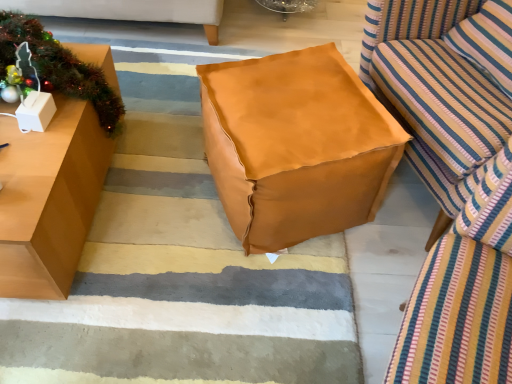
What do you see at coordinates (453, 178) in the screenshot? I see `striped fabric studio couch at right` at bounding box center [453, 178].

At what (x,y) coordinates should I click in order to perform the action: click on brown leather ottoman at center. Please return your answer as a coordinate pair (x, y). Looking at the image, I should click on (182, 274).

Locate an element on the screen. This screenshot has width=512, height=384. metallic green garland at left is located at coordinates coord(60,67).

Image resolution: width=512 pixels, height=384 pixels. In order to click on white cardboard box at left in this screenshot , I will do `click(36, 111)`.

Image resolution: width=512 pixels, height=384 pixels. Find the location of `matte brown table at left`. matte brown table at left is located at coordinates (49, 198).

Where is `striped fabric studio couch at right`? striped fabric studio couch at right is located at coordinates (453, 178).

Is white cardboard box at left not near leather-like tan bean bag at center?

That's not correct — white cardboard box at left is a little close to leather-like tan bean bag at center.

Do you think white cardboard box at left is within leather-like tan bean bag at center, or outside of it?

white cardboard box at left is located beyond the bounds of leather-like tan bean bag at center.

At what (x,y) coordinates should I click in order to perform the action: click on cardboard box above the leather-like tan bean bag at center (from the image's perspective). Please return your answer as a coordinate pair (x, y). Image resolution: width=512 pixels, height=384 pixels. Looking at the image, I should click on click(x=36, y=111).

From the image's perspective, is white cardboard box at left under leather-like tan bean bag at center?

Actually, white cardboard box at left appears above leather-like tan bean bag at center in the image.

Which of these two, striped fabric pillow at right or white cardboard box at left, is thinner?

Thinner between the two is white cardboard box at left.

The height and width of the screenshot is (384, 512). In order to click on pillow above the white cardboard box at left (from the image's perspective) in this screenshot , I will do `click(487, 42)`.

Is there a large distance between striped fabric pillow at right and white cardboard box at left?

That's right, there is a large distance between striped fabric pillow at right and white cardboard box at left.

Is striped fabric pillow at right outside of white cardboard box at left?

That's correct, striped fabric pillow at right is outside of white cardboard box at left.

Would you say leather-like tan bean bag at center is outside striped fabric pillow at right?

Yes, leather-like tan bean bag at center is located beyond the bounds of striped fabric pillow at right.

Is point (282, 117) closer to viewer compared to point (467, 21)?

Yes.

How far apart are leather-like tan bean bag at center and striped fabric pillow at right?

leather-like tan bean bag at center is 59.32 centimeters away from striped fabric pillow at right.

Does leather-like tan bean bag at center have a larger size compared to striped fabric pillow at right?

Yes.

From a real-world perspective, is white cardboard box at left positioned above or below metallic green garland at left?

white cardboard box at left is above metallic green garland at left.

Can metallic green garland at left be found inside white cardboard box at left?

No, metallic green garland at left is not surrounded by white cardboard box at left.

Is the surface of white cardboard box at left in direct contact with metallic green garland at left?

No, white cardboard box at left is not beside metallic green garland at left.

Can you confirm if white cardboard box at left is smaller than metallic green garland at left?

Indeed, white cardboard box at left has a smaller size compared to metallic green garland at left.

Is matte brown table at left wider than brown leather ottoman at center?

In fact, matte brown table at left might be narrower than brown leather ottoman at center.

Is matte brown table at left at the right side of brown leather ottoman at center?

Incorrect, matte brown table at left is not on the right side of brown leather ottoman at center.

Considering the sizes of objects matte brown table at left and brown leather ottoman at center in the image provided, who is bigger, matte brown table at left or brown leather ottoman at center?

matte brown table at left.

Considering the relative sizes of matte brown table at left and brown leather ottoman at center in the image provided, is matte brown table at left shorter than brown leather ottoman at center?

No.

Is metallic green garland at left wider than matte brown table at left?

No, metallic green garland at left is not wider than matte brown table at left.

From the image's perspective, between metallic green garland at left and matte brown table at left, which one is located above?

From the image's view, metallic green garland at left is above.

How different are the orientations of metallic green garland at left and matte brown table at left in degrees?

The angular difference between metallic green garland at left and matte brown table at left is 2.08 degrees.

From a real-world perspective, which is physically below, metallic green garland at left or matte brown table at left?

matte brown table at left.

Looking at this image, which object is wider, leather-like tan bean bag at center or brown leather ottoman at center?

brown leather ottoman at center.

Is point (252, 182) more distant than point (187, 320)?

No, (252, 182) is in front of (187, 320).

Can you tell me how much leather-like tan bean bag at center and brown leather ottoman at center differ in facing direction?

leather-like tan bean bag at center and brown leather ottoman at center are facing 158 degrees away from each other.

Locate an element on the screen. bean bag chair that appears below the white cardboard box at left (from a real-world perspective) is located at coordinates (296, 146).

The height and width of the screenshot is (384, 512). In order to click on pillow on the right side of white cardboard box at left in this screenshot , I will do `click(487, 42)`.

Which object lies nearer to the anchor point leather-like tan bean bag at center, metallic green garland at left or white cardboard box at left?

metallic green garland at left is closer to leather-like tan bean bag at center.

From the image, which object appears to be farther from brown leather ottoman at center, matte brown table at left or metallic green garland at left?

metallic green garland at left.

Estimate the real-world distances between objects in this image. Which object is closer to matte brown table at left, striped fabric pillow at right or white cardboard box at left?

white cardboard box at left is positioned closer to the anchor matte brown table at left.

When comparing their distances from leather-like tan bean bag at center, does white cardboard box at left or brown leather ottoman at center seem further?

white cardboard box at left is positioned further to the anchor leather-like tan bean bag at center.

Considering their positions, is matte brown table at left positioned closer to brown leather ottoman at center than white cardboard box at left?

Based on the image, matte brown table at left appears to be nearer to brown leather ottoman at center.

Looking at the image, which one is located further to leather-like tan bean bag at center, striped fabric studio couch at right or white cardboard box at left?

Among the two, white cardboard box at left is located further to leather-like tan bean bag at center.

When comparing their distances from leather-like tan bean bag at center, does brown leather ottoman at center or metallic green garland at left seem closer?

Among the two, brown leather ottoman at center is located nearer to leather-like tan bean bag at center.

From the image, which object appears to be nearer to matte brown table at left, striped fabric pillow at right or striped fabric studio couch at right?

The object closer to matte brown table at left is striped fabric studio couch at right.

Find the location of a particular element. The width and height of the screenshot is (512, 384). bean bag chair between white cardboard box at left and striped fabric studio couch at right from left to right is located at coordinates (296, 146).

Where is `stair between white cardboard box at left and striped fabric pillow at right`? This screenshot has width=512, height=384. stair between white cardboard box at left and striped fabric pillow at right is located at coordinates (182, 274).

Where is `studio couch between matte brown table at left and striped fabric pillow at right from left to right`? The height and width of the screenshot is (384, 512). studio couch between matte brown table at left and striped fabric pillow at right from left to right is located at coordinates pyautogui.click(x=453, y=178).

Where is `bean bag chair between white cardboard box at left and striped fabric pillow at right`? The width and height of the screenshot is (512, 384). bean bag chair between white cardboard box at left and striped fabric pillow at right is located at coordinates (296, 146).